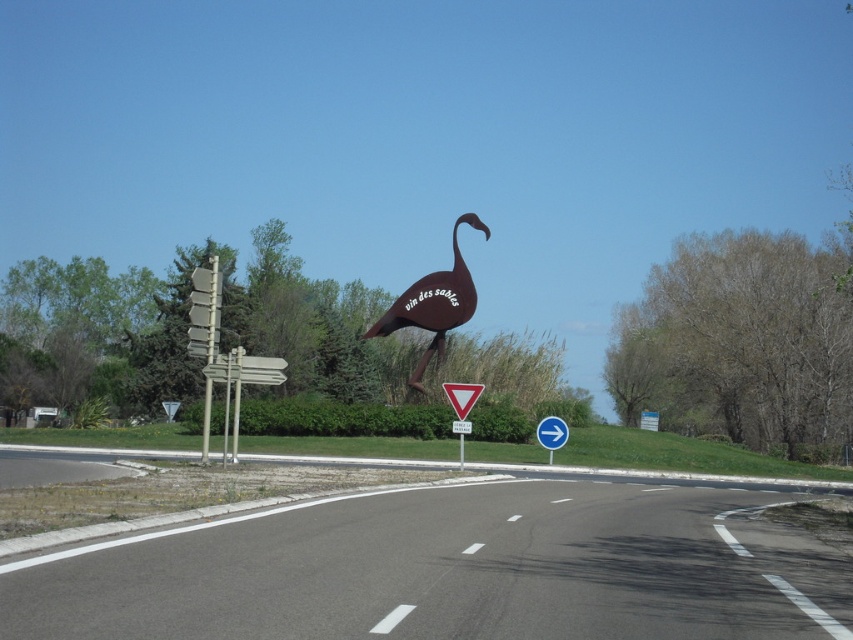
You are a delivery driver navigating a road with a curved path. You see a brown matte sign at center ahead. Can you determine the direction of the upcoming curve based on the sign and the road markings?

The brown matte sign at center is located at point (433, 304), which is in the center of the image. Since the road is curved and the sign is centrally positioned, the curve is likely to be in the direction where the road continues naturally from the sign. However, without specific directional indicators on the sign, the exact direction cannot be determined solely from the provided information.

You are a truck driver planning to deliver a large cargo container that is 2 meters wide. You see the brown matte sign at center and the brushed metal triangle at center along the roadside. Which object can you see in your side mirror if your container is blocking the smaller one?

The brown matte sign at center is bigger than the brushed metal triangle at center, so the container would block the smaller brushed metal triangle at center, leaving the brown matte sign at center visible in the side mirror.

You are a driver approaching the curved road and see the brown matte sign at center and the brushed metal triangle at center ahead. Which object appears taller from your perspective?

The brown matte sign at center is taller than the brushed metal triangle at center, so the brown matte sign at center appears taller.